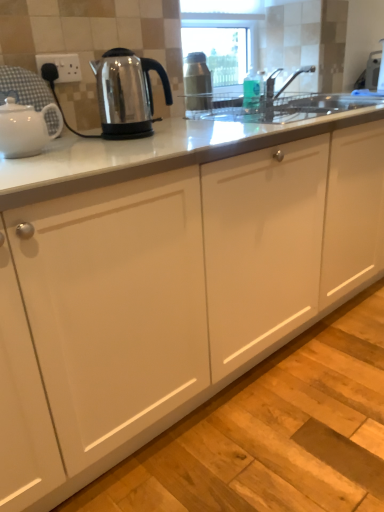
Question: Can you confirm if white plastic socket at upper left is positioned to the left of stainless steel kettle at left, positioned as the 1th kettle in right-to-left order?

Choices:
 (A) yes
 (B) no

Answer: (A)

Question: Is white plastic socket at upper left at the right side of stainless steel kettle at left, the second kettle viewed from the left?

Choices:
 (A) yes
 (B) no

Answer: (B)

Question: Is white plastic socket at upper left thinner than stainless steel kettle at left, positioned as the 1th kettle in right-to-left order?

Choices:
 (A) yes
 (B) no

Answer: (A)

Question: Is white plastic socket at upper left outside stainless steel kettle at left, the second kettle viewed from the left?

Choices:
 (A) no
 (B) yes

Answer: (B)

Question: From the image's perspective, is white plastic socket at upper left below stainless steel kettle at left, positioned as the 1th kettle in right-to-left order?

Choices:
 (A) yes
 (B) no

Answer: (B)

Question: Considering the relative sizes of white plastic socket at upper left and stainless steel kettle at left, positioned as the 1th kettle in right-to-left order, in the image provided, is white plastic socket at upper left taller than stainless steel kettle at left, positioned as the 1th kettle in right-to-left order,?

Choices:
 (A) yes
 (B) no

Answer: (B)

Question: Would you say white glossy teapot at left, placed as the first kettle when sorted from left to right, contains stainless steel kettle at left, positioned as the 1th kettle in right-to-left order?

Choices:
 (A) no
 (B) yes

Answer: (A)

Question: From the image's perspective, is white glossy teapot at left, marked as the 2th kettle in a right-to-left arrangement, over stainless steel kettle at left, positioned as the 1th kettle in right-to-left order?

Choices:
 (A) no
 (B) yes

Answer: (A)

Question: Can you confirm if white glossy teapot at left, placed as the first kettle when sorted from left to right, is shorter than stainless steel kettle at left, positioned as the 1th kettle in right-to-left order?

Choices:
 (A) no
 (B) yes

Answer: (B)

Question: Considering the relative sizes of white glossy teapot at left, placed as the first kettle when sorted from left to right, and stainless steel kettle at left, positioned as the 1th kettle in right-to-left order, in the image provided, is white glossy teapot at left, placed as the first kettle when sorted from left to right, taller than stainless steel kettle at left, positioned as the 1th kettle in right-to-left order,?

Choices:
 (A) no
 (B) yes

Answer: (A)

Question: Is white glossy teapot at left, marked as the 2th kettle in a right-to-left arrangement, turned away from stainless steel kettle at left, positioned as the 1th kettle in right-to-left order?

Choices:
 (A) yes
 (B) no

Answer: (B)

Question: Is white glossy teapot at left, marked as the 2th kettle in a right-to-left arrangement, oriented towards stainless steel kettle at left, the second kettle viewed from the left?

Choices:
 (A) yes
 (B) no

Answer: (B)

Question: Is white plastic socket at upper left surrounding white glossy teapot at left, placed as the first kettle when sorted from left to right?

Choices:
 (A) yes
 (B) no

Answer: (B)